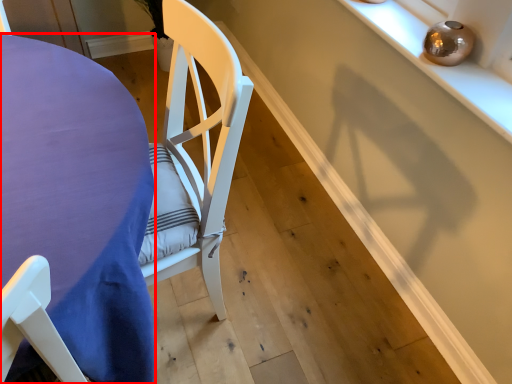
Question: In this image, where is table (annotated by the red box) located relative to shelf?

Choices:
 (A) right
 (B) left

Answer: (B)